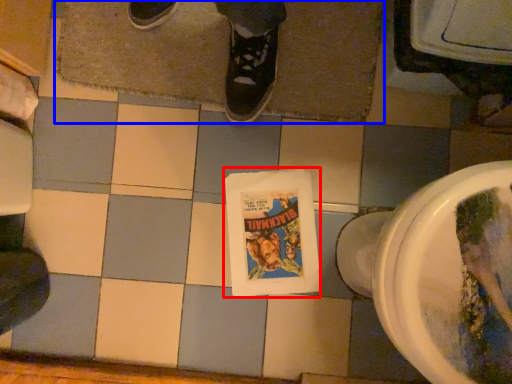
Question: Which object appears farthest to the camera in this image, comic book (highlighted by a red box) or bath mat (highlighted by a blue box)?

Choices:
 (A) comic book
 (B) bath mat

Answer: (A)